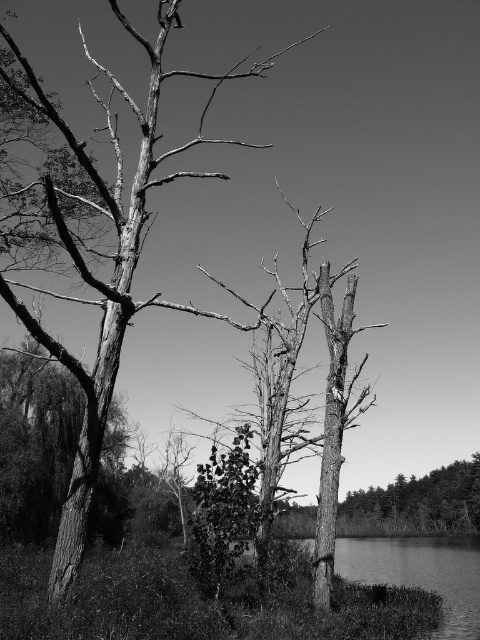
Question: Can you confirm if smooth water at lower right is bigger than smooth bark tree at lower right?

Choices:
 (A) no
 (B) yes

Answer: (B)

Question: Does dead wood tree at center have a greater width compared to smooth bark tree at lower right?

Choices:
 (A) yes
 (B) no

Answer: (A)

Question: Which point appears farthest from the camera in this image?

Choices:
 (A) (72, 477)
 (B) (430, 556)

Answer: (B)

Question: Is smooth water at lower right in front of smooth bark tree at lower right?

Choices:
 (A) yes
 (B) no

Answer: (A)

Question: Which point is farther to the camera?

Choices:
 (A) (367, 492)
 (B) (160, 4)

Answer: (A)

Question: Which of the following is the closest to the observer?

Choices:
 (A) (24, 259)
 (B) (427, 492)

Answer: (A)